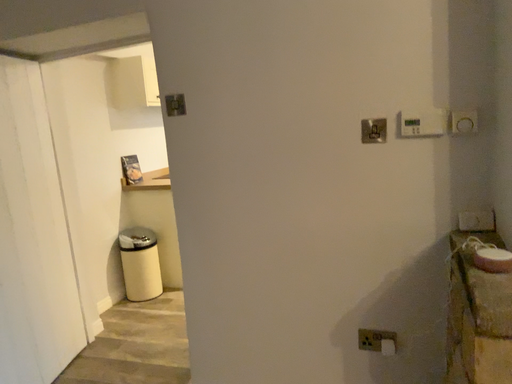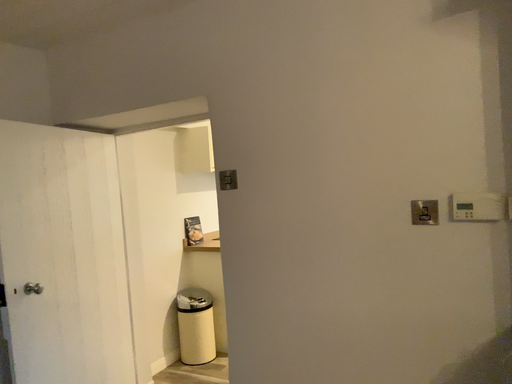
Question: Which way did the camera rotate in the video?

Choices:
 (A) rotated right
 (B) rotated left

Answer: (B)